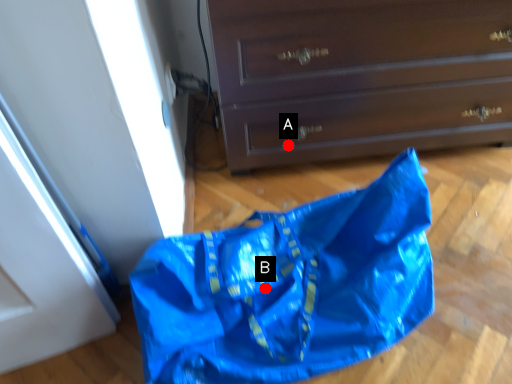
Question: Two points are circled on the image, labeled by A and B beside each circle. Which point is closer to the camera?

Choices:
 (A) A is closer
 (B) B is closer

Answer: (B)